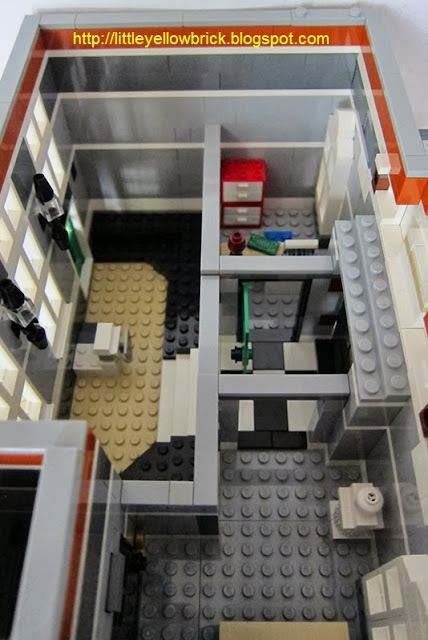
Find the location of a particular element. This screenshot has width=428, height=640. closest arched window is located at coordinates (393, 592).